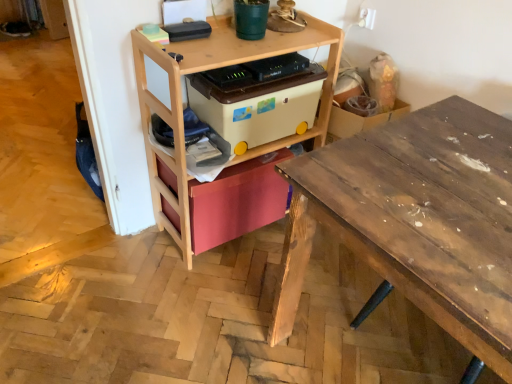
Question: Is point (264, 102) closer or farther from the camera than point (401, 218)?

Choices:
 (A) farther
 (B) closer

Answer: (A)

Question: Considering the positions of beige plastic storage box at center, acting as the second storage box starting from the bottom, and wooden desk at right in the image, is beige plastic storage box at center, acting as the second storage box starting from the bottom, taller or shorter than wooden desk at right?

Choices:
 (A) tall
 (B) short

Answer: (B)

Question: Which object is the closest to the beige plastic storage box at center, acting as the second storage box starting from the bottom?

Choices:
 (A) wooden shelf at center
 (B) matte pink drawer at center, the second storage box from the top
 (C) wooden desk at right

Answer: (A)

Question: Which is farther from the wooden shelf at center?

Choices:
 (A) matte pink drawer at center, the second storage box from the top
 (B) wooden desk at right
 (C) beige plastic storage box at center, which is the 1th storage box from top to bottom

Answer: (B)